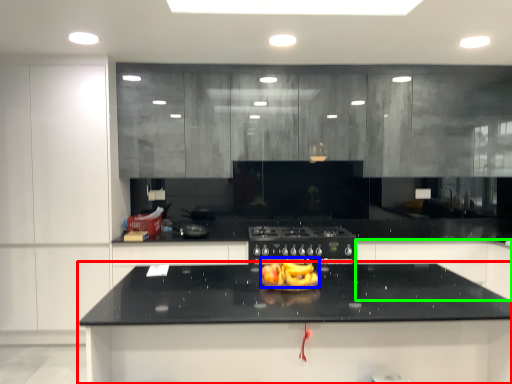
Question: Considering the real-world distances, which object is closest to countertop (highlighted by a red box)? food (highlighted by a blue box) or cabinetry (highlighted by a green box).

Choices:
 (A) food
 (B) cabinetry

Answer: (A)